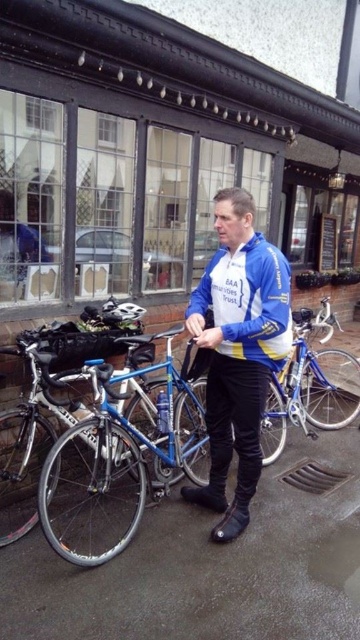
Question: Can you confirm if blue jersey at center is positioned above shiny silver bicycle at left?

Choices:
 (A) yes
 (B) no

Answer: (A)

Question: Among these points, which one is farthest from the camera?

Choices:
 (A) (222, 531)
 (B) (227, 308)
 (C) (77, 548)
 (D) (312, 435)

Answer: (D)

Question: Which point is farther to the camera?

Choices:
 (A) blue jersey at center
 (B) blue fabric jacket at center
 (C) blue metallic bicycle at center

Answer: (C)

Question: Can you confirm if shiny blue frame at center is wider than blue metallic bicycle at center?

Choices:
 (A) no
 (B) yes

Answer: (A)

Question: Which point is farther from the camera taking this photo?

Choices:
 (A) (45, 396)
 (B) (110, 426)
 (C) (240, 385)

Answer: (A)

Question: Is blue fabric jacket at center below shiny silver bicycle at left?

Choices:
 (A) no
 (B) yes

Answer: (A)